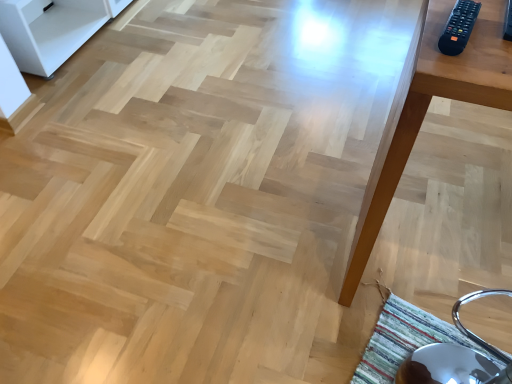
You are a GUI agent. You are given a task and a screenshot of the screen. Output one action in this format:
    pyautogui.click(x=<x>, y=<y>)
    Task: Click on the vacant area on the back side of light brown wood table at right
    
    Given the screenshot: What is the action you would take?
    pyautogui.click(x=407, y=163)